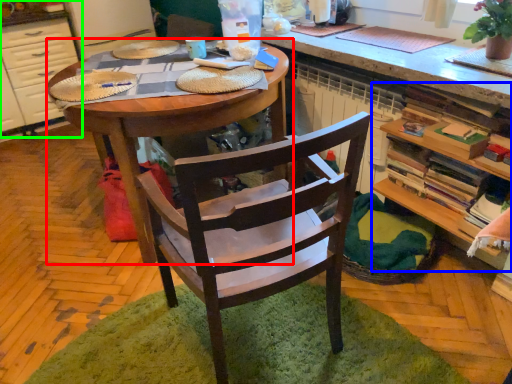
Question: Estimate the real-world distances between objects in this image. Which object is farther from desk (highlighted by a red box), shelf (highlighted by a blue box) or cabinetry (highlighted by a green box)?

Choices:
 (A) shelf
 (B) cabinetry

Answer: (B)